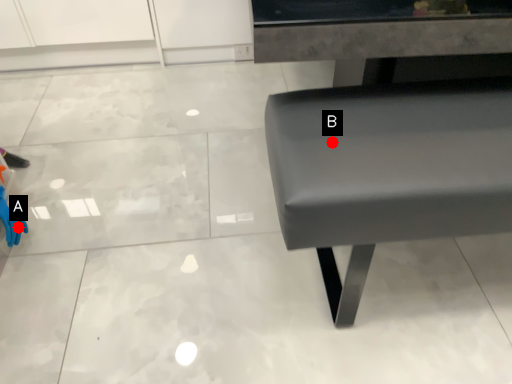
Question: Two points are circled on the image, labeled by A and B beside each circle. Which point is closer to the camera taking this photo?

Choices:
 (A) A is closer
 (B) B is closer

Answer: (B)